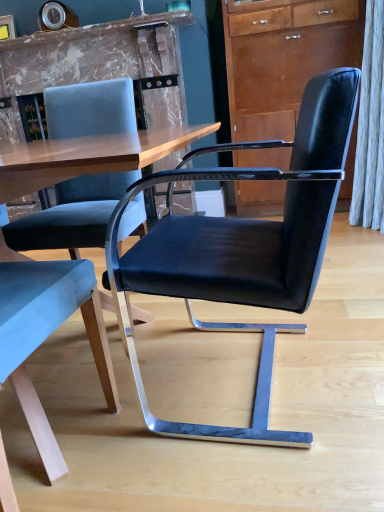
At what (x,y) coordinates should I click in order to perform the action: click on empty space that is to the right of black leather chair at center, placed as the second chair when sorted from left to right. Please return your answer as a coordinate pair (x, y). The width and height of the screenshot is (384, 512). Looking at the image, I should click on (354, 337).